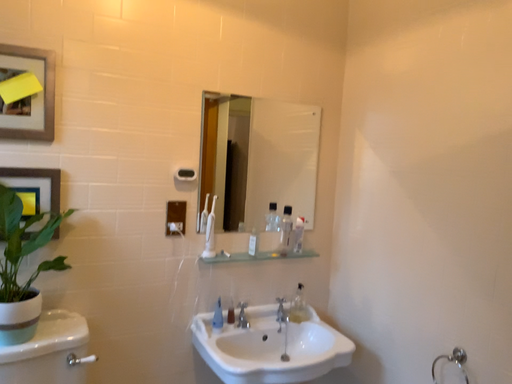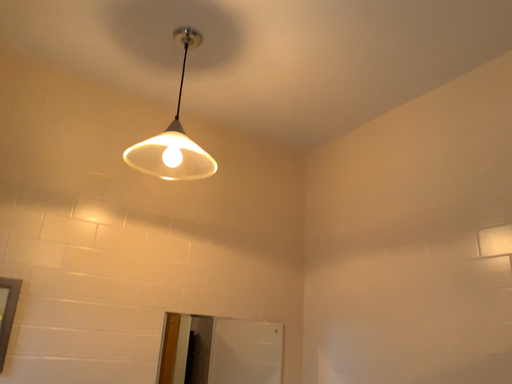
Question: How did the camera likely rotate when shooting the video?

Choices:
 (A) rotated downward
 (B) rotated upward

Answer: (B)